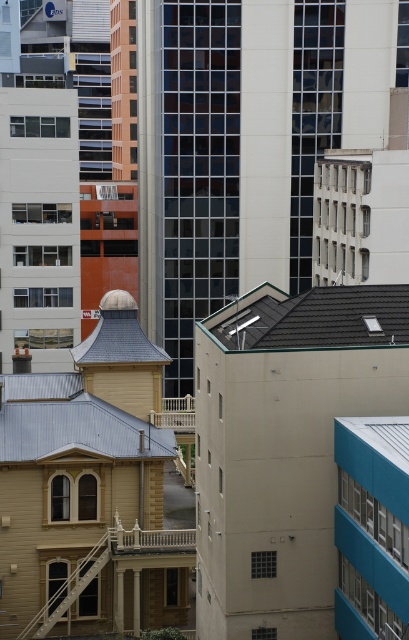
You are standing in the urban area and want to take a photo of the gray tile roof at center. Considering the distance, do you think you can capture it clearly with a standard smartphone camera?

The gray tile roof at center is 53.93 meters from viewer. A standard smartphone camera typically has a maximum effective range of around 50 meters for clear photos, so capturing it clearly might be challenging due to the distance.

You are an architect analyzing the rooftops of two buildings in the image. The traditional building has a gray tile roof at center and the modern building has a metallic gray roof at center. Which roof has a smaller width?

The gray tile roof at center is thinner than the metallic gray roof at center, so the gray tile roof at center has a smaller width.

You are an architect evaluating the rooftop space of the two buildings in the image. Which of the two roofs, the gray tile roof at center or the metallic gray roof at center, offers a larger surface area for potential solar panel installation?

The metallic gray roof at center has a larger size than the gray tile roof at center, so it offers a larger surface area for solar panel installation.